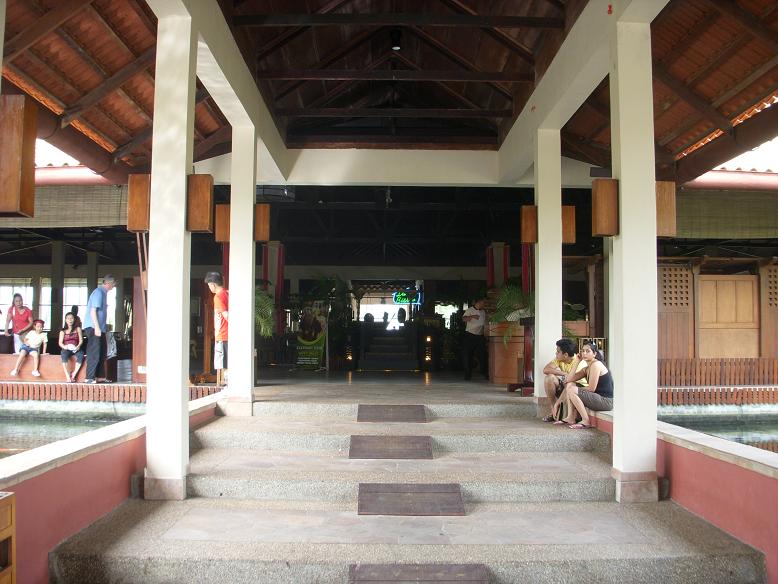
You are a GUI agent. You are given a task and a screenshot of the screen. Output one action in this format:
    pyautogui.click(x=<x>, y=<y>)
    Task: Click on the white rectangular pillar
    The width and height of the screenshot is (778, 584).
    Given the screenshot: What is the action you would take?
    pyautogui.click(x=172, y=274), pyautogui.click(x=242, y=279), pyautogui.click(x=545, y=263), pyautogui.click(x=639, y=308)